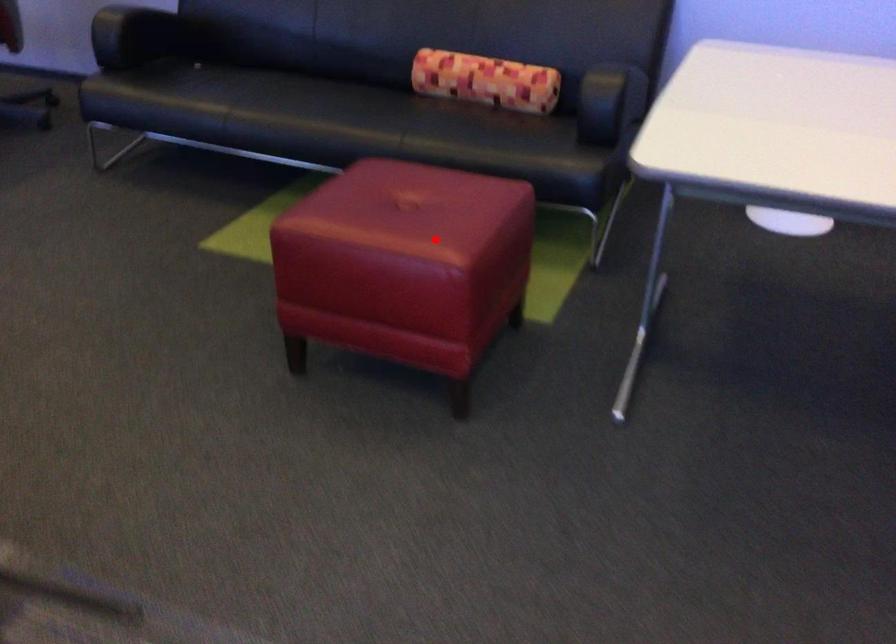
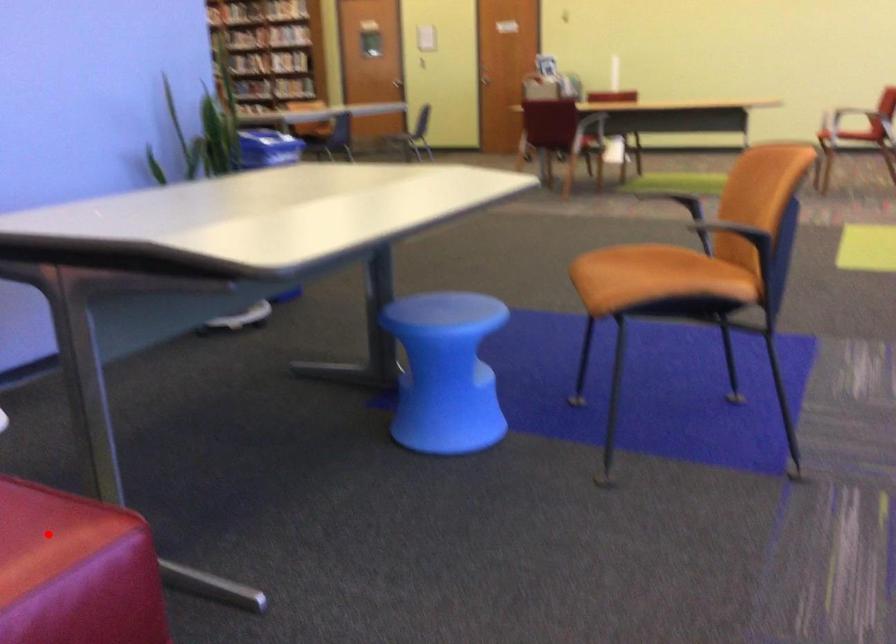
I am providing you with two images of the same scene from different viewpoints. A red point is marked on the first image and another point is marked on the second image. Does the point marked in image1 correspond to the same location as the one in image2?

Yes